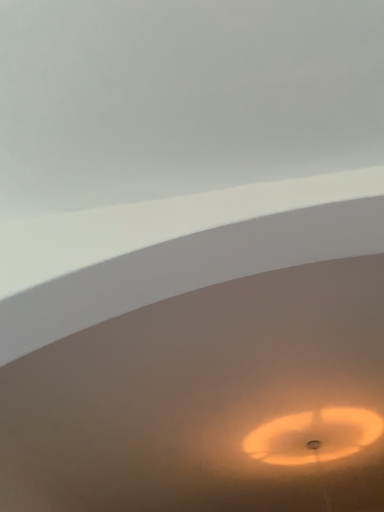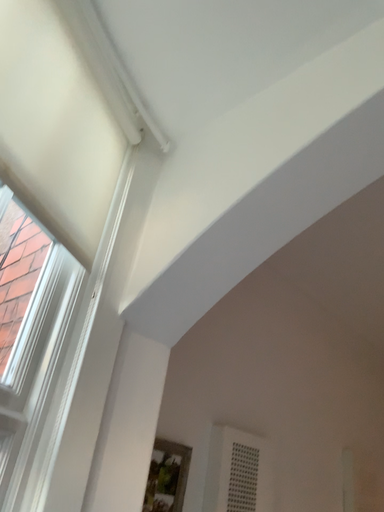
Question: How did the camera likely rotate when shooting the video?

Choices:
 (A) rotated left
 (B) rotated right

Answer: (A)